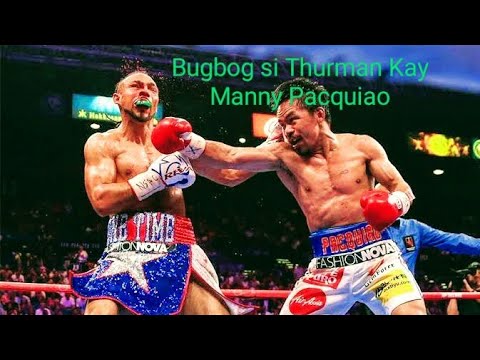
The height and width of the screenshot is (360, 480). I want to click on large screens, so click(99, 105), click(267, 124), click(433, 141).